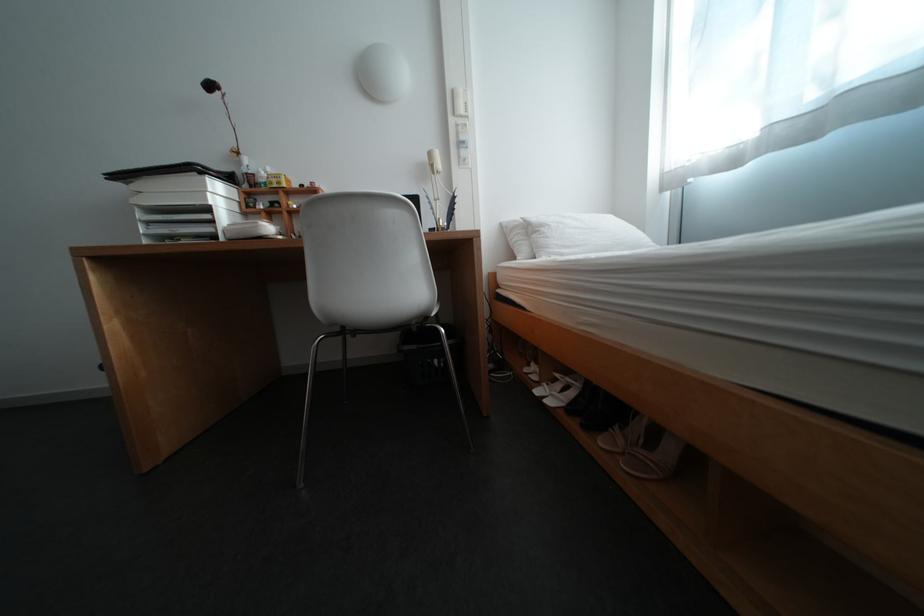
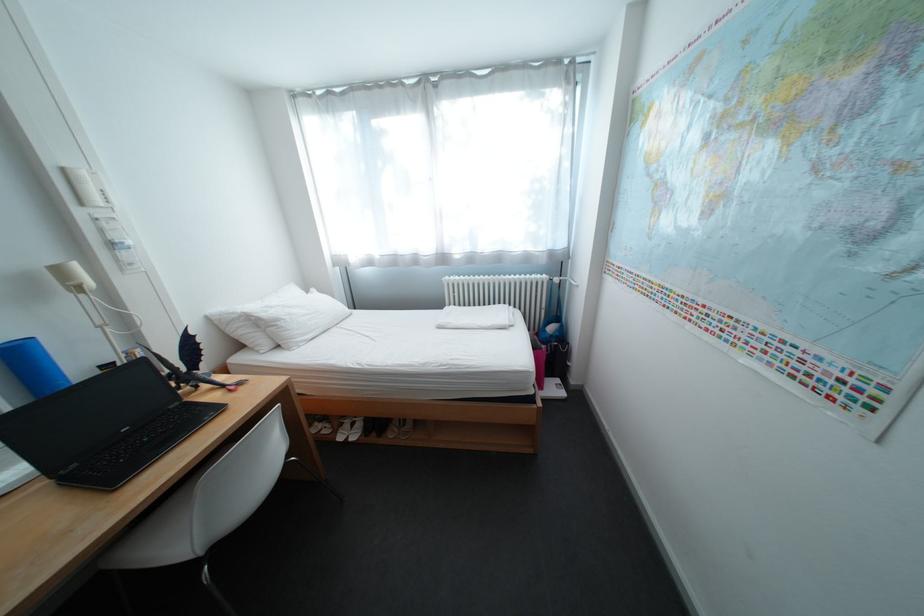
Where in the second image is the point corresponding to the point at 443,156 from the first image?

(71, 272)